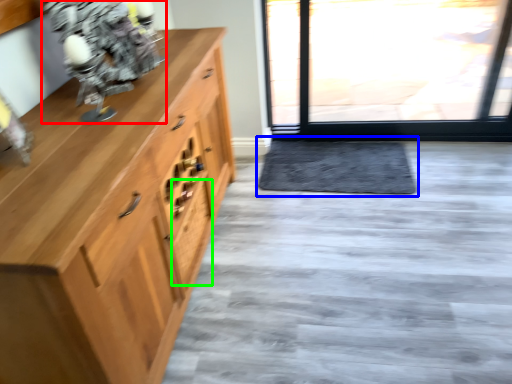
Question: Estimate the real-world distances between objects in this image. Which object is farther from figurine (highlighted by a red box), doormat (highlighted by a blue box) or drawer (highlighted by a green box)?

Choices:
 (A) doormat
 (B) drawer

Answer: (A)